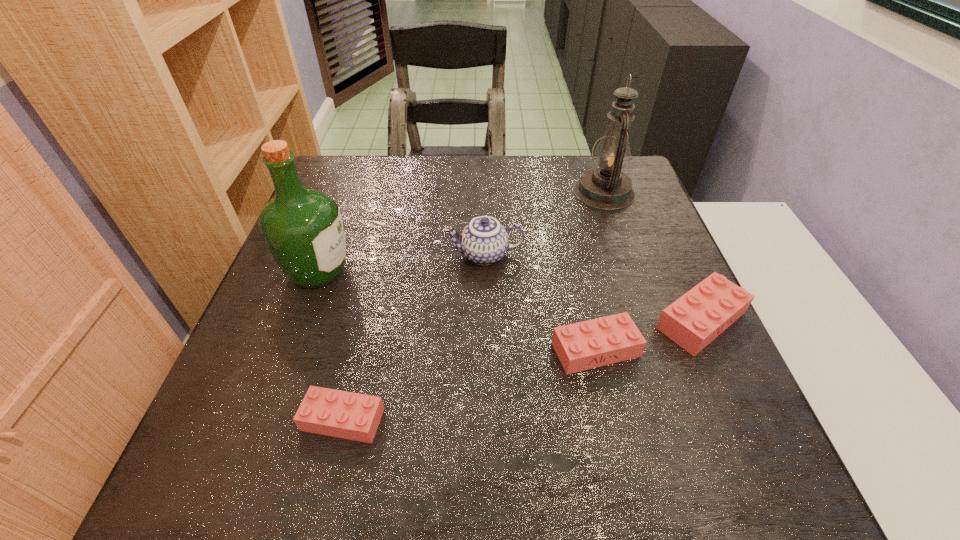
Find the location of a particular element. The height and width of the screenshot is (540, 960). the shortest Lego is located at coordinates click(342, 414).

Find the location of `the shortest object`. the shortest object is located at coordinates (342, 414).

Where is `the fifth tallest object`? the fifth tallest object is located at coordinates (598, 342).

Where is `the second Lego from right to left`? The image size is (960, 540). the second Lego from right to left is located at coordinates (598, 342).

Locate an element on the screen. This screenshot has height=540, width=960. the rightmost Lego is located at coordinates click(x=694, y=320).

Image resolution: width=960 pixels, height=540 pixels. Identify the location of the farthest object. (606, 187).

Image resolution: width=960 pixels, height=540 pixels. I want to click on liquor, so click(x=303, y=229).

Locate an element on the screen. This screenshot has width=960, height=540. the third object from left to right is located at coordinates (484, 241).

Find the location of `chinaware`. chinaware is located at coordinates (484, 241).

You are a GUI agent. You are given a task and a screenshot of the screen. Output one action in this format:
    pyautogui.click(x=<x>, y=<y>)
    Task: Click on the vacant space positioned on the right of the nearest Lego
    The height and width of the screenshot is (540, 960).
    Given the screenshot: What is the action you would take?
    pyautogui.click(x=496, y=420)